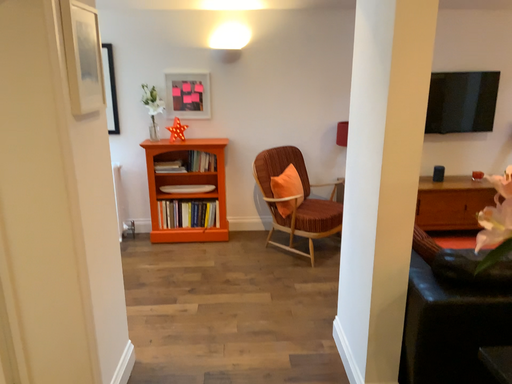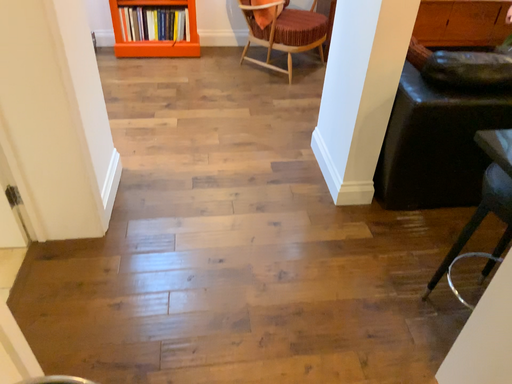
Question: Which way did the camera rotate in the video?

Choices:
 (A) rotated downward
 (B) rotated upward

Answer: (A)